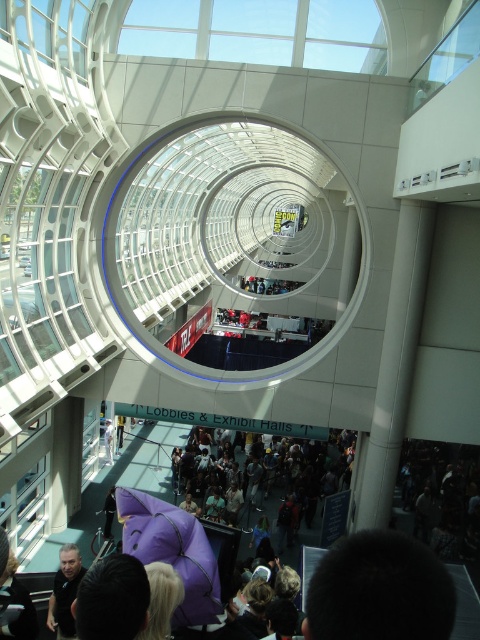
In the scene shown: You are at the exhibition hall and want to reach the exit located at the far right corner. You see the purple fabric crowd at lower center and the dark gray shirt at lower left. Which path should you choose to avoid the crowd?

The dark gray shirt at lower left is narrower than the purple fabric crowd at lower center, so choosing the path near the dark gray shirt at lower left would be less crowded.

You are attending an event at this convention center and notice two purple items at the center of the area. Which one would you say is bigger, the purple fabric umbrella at center or the purple plush toy at center?

The purple fabric umbrella at center has a larger size compared to the purple plush toy at center, so the purple fabric umbrella at center is bigger.